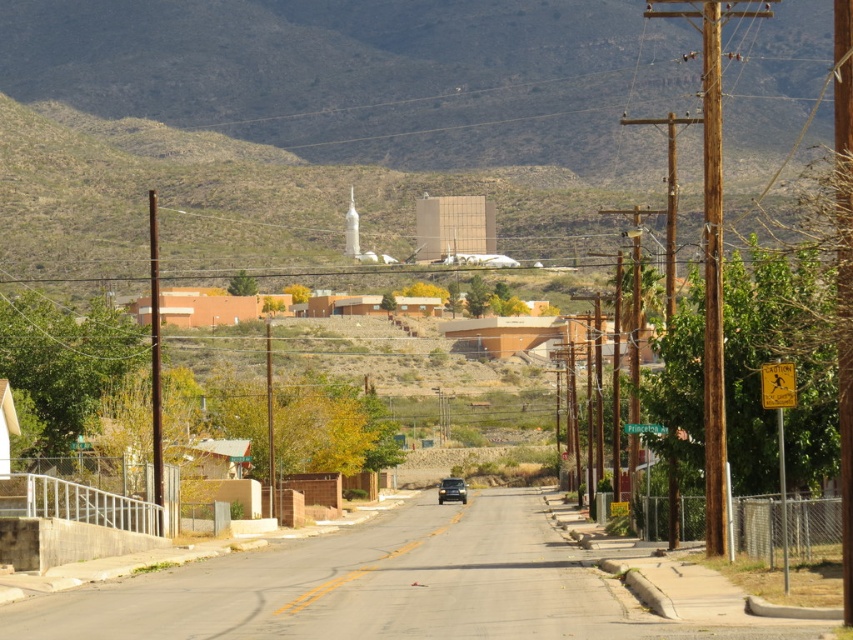
Based on the photo, is brown rocky mountain at upper center further to camera compared to orange stucco buildings at center?

That is True.

Describe the element at coordinates (369, 74) in the screenshot. Image resolution: width=853 pixels, height=640 pixels. I see `brown rocky mountain at upper center` at that location.

Identify the location of brown rocky mountain at upper center. This screenshot has width=853, height=640. (369, 74).

Who is more forward, (x=331, y=99) or (x=457, y=490)?

Point (x=457, y=490) is more forward.

Is brown rocky mountain at upper center above metallic gold suv at center?

Correct, brown rocky mountain at upper center is located above metallic gold suv at center.

Between point (260, 122) and point (466, 492), which one is positioned behind?

The point (260, 122) is more distant.

The height and width of the screenshot is (640, 853). Identify the location of brown rocky mountain at upper center. (369, 74).

Does point (189, 316) come farther from viewer compared to point (462, 497)?

Yes, it is.

Who is higher up, orange stucco buildings at center or metallic gold suv at center?

orange stucco buildings at center is higher up.

Where is `orange stucco buildings at center`? The width and height of the screenshot is (853, 640). orange stucco buildings at center is located at coordinates (238, 305).